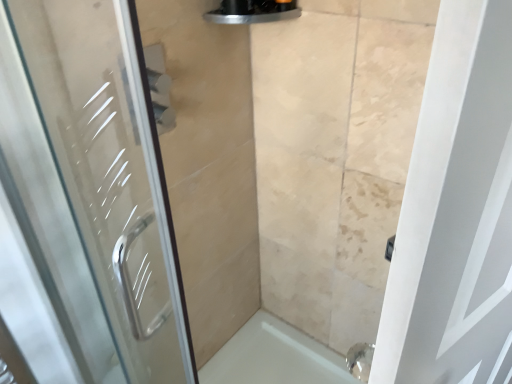
Where is `white matte door at right`? Image resolution: width=512 pixels, height=384 pixels. white matte door at right is located at coordinates (456, 212).

Measure the distance between point (476,28) and camera.

Point (476,28) and camera are 11.38 inches apart.

The image size is (512, 384). What do you see at coordinates (456, 212) in the screenshot?
I see `white matte door at right` at bounding box center [456, 212].

I want to click on white matte door at right, so click(x=456, y=212).